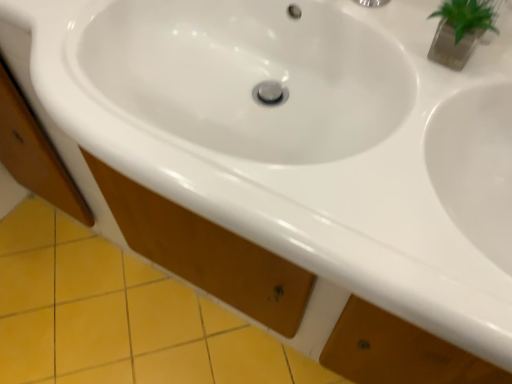
What are the coordinates of `green leafy plant at upper right` in the screenshot? It's located at (467, 16).

What do you see at coordinates (467, 16) in the screenshot? The image size is (512, 384). I see `green leafy plant at upper right` at bounding box center [467, 16].

Where is `green leafy plant at upper right`? This screenshot has height=384, width=512. green leafy plant at upper right is located at coordinates (467, 16).